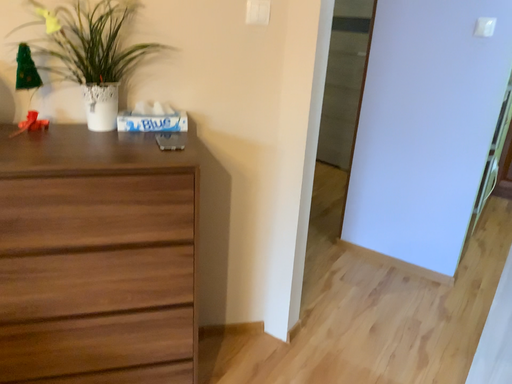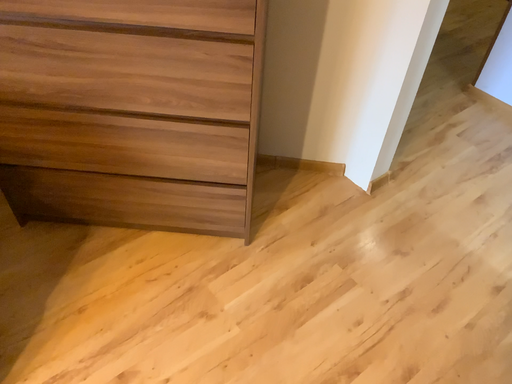
Question: Which way did the camera rotate in the video?

Choices:
 (A) rotated left
 (B) rotated right

Answer: (A)